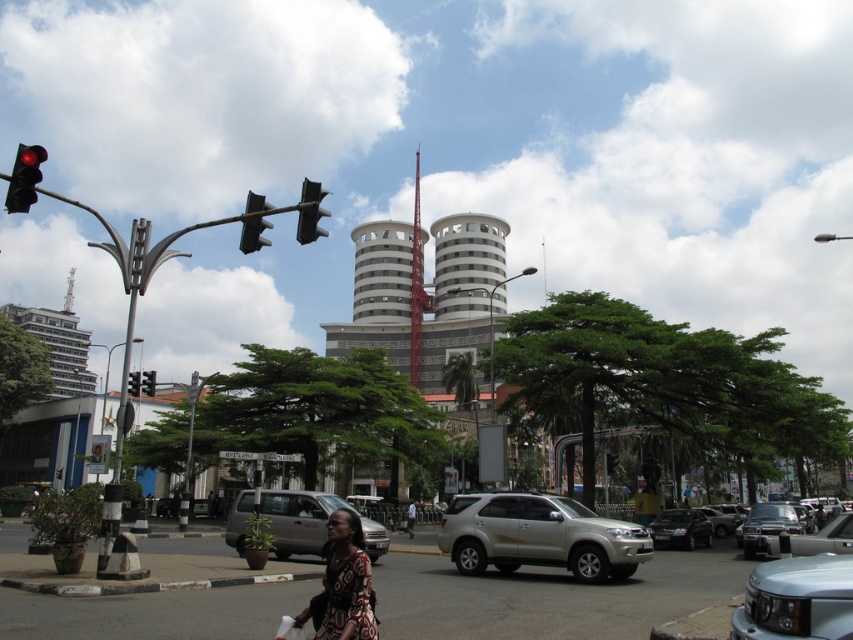
Consider the image. You are a pedestrian standing on the sidewalk and want to cross the street. You see the shiny black sedan at center and the metallic traffic light at upper center. Which object is closer to you?

The shiny black sedan at center is closer to you because it is further to the viewer than the metallic traffic light at upper center.

You are standing at the pedestrian crossing and want to reach both the point at coordinates point (691, 512) and the point at coordinates point (314, 209). Which point will you reach first?

You will reach point (691, 512) first because it is closer to you than point (314, 209), which is further away.

From the picture: You are a delivery person needing to park your 2.5 meters wide van. You see the metallic silver car at center and the black plastic traffic light at left. Which object indicates a space where your van can fit?

The metallic silver car at center has a lesser width compared to black plastic traffic light at left, so the space next to the metallic silver car at center is narrower. Since your van is 2.5 meters wide, it might not fit there. The space near the black plastic traffic light at left is wider, so your van can fit there.